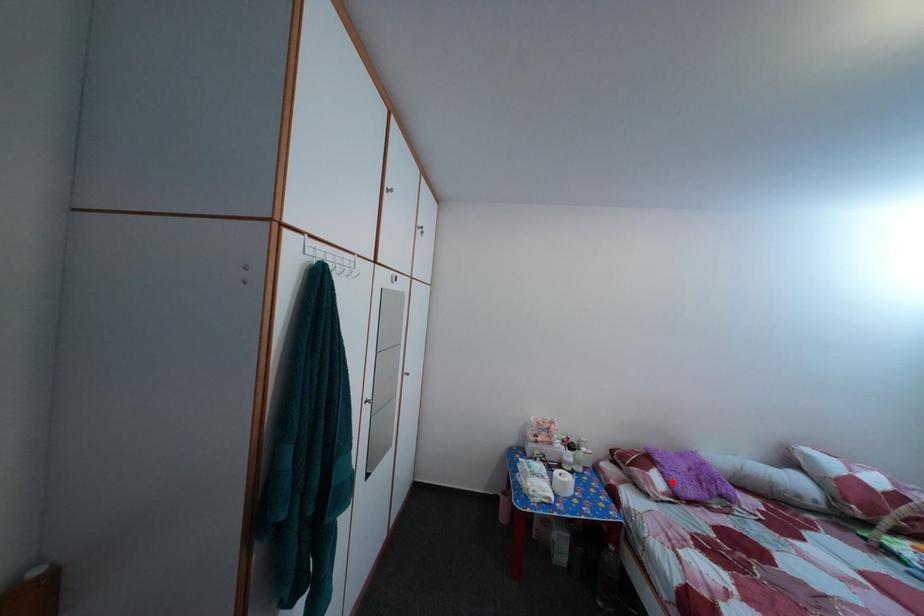
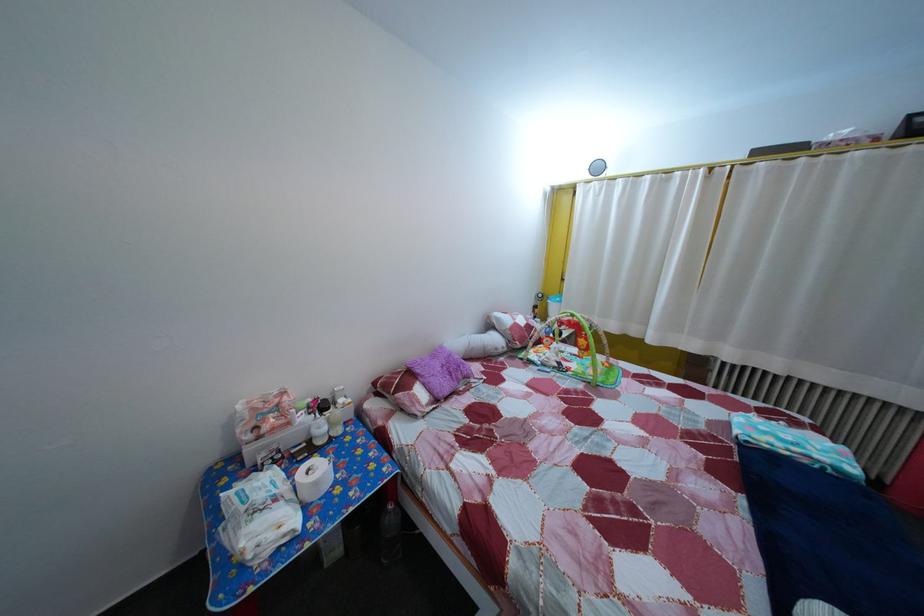
Where in the second image is the point corresponding to the highlighted location from the first image?

(433, 392)